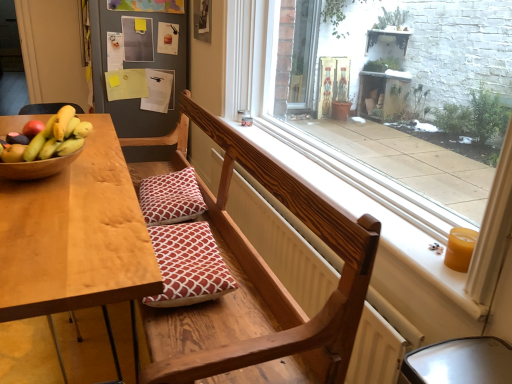
The image size is (512, 384). Identify the location of wooden bench at center. (266, 286).

The width and height of the screenshot is (512, 384). What do you see at coordinates (266, 286) in the screenshot?
I see `wooden bench at center` at bounding box center [266, 286].

At what (x,y) coordinates should I click in order to perform the action: click on red printed cushion at center, which is the 2th pillow in bottom-to-top order. Please return your answer as a coordinate pair (x, y). Looking at the image, I should click on (170, 198).

Measure the distance between point (x=296, y=152) and camera.

Point (x=296, y=152) is 1.93 meters away from camera.

The height and width of the screenshot is (384, 512). What do you see at coordinates (188, 265) in the screenshot? I see `red cotton pillow at center, acting as the 1th pillow starting from the front` at bounding box center [188, 265].

What is the approximate height of yellow wax candle at right?

yellow wax candle at right is 10.22 centimeters in height.

Describe the element at coordinates (284, 243) in the screenshot. I see `wooden radiator at center` at that location.

In the scene shown: What is the approximate height of shiny yellow bananas at table left?

It is 5.24 inches.

Find the location of a particular element. This screenshot has width=512, height=384. wooden table at left is located at coordinates (76, 245).

The image size is (512, 384). What do you see at coordinates (76, 245) in the screenshot?
I see `wooden table at left` at bounding box center [76, 245].

This screenshot has height=384, width=512. In order to click on wooden bench at center in this screenshot , I will do `click(266, 286)`.

Looking at this image, is wooden table at left positioned with its back to red printed cushion at center, which appears as the first pillow when viewed from the top?

Yes, wooden table at left's orientation is away from red printed cushion at center, which appears as the first pillow when viewed from the top.

Does point (5, 291) lie behind point (152, 211)?

No, it is not.

The width and height of the screenshot is (512, 384). What are the coordinates of `kitchen & dining room table that is under the red printed cushion at center, placed as the 2th pillow when sorted from front to back (from a real-world perspective)` in the screenshot? It's located at (76, 245).

Is wooden table at left completely or partially outside of red printed cushion at center, which appears as the first pillow when viewed from the top?

That's correct, wooden table at left is outside of red printed cushion at center, which appears as the first pillow when viewed from the top.

What's the angular difference between transparent glass window at center and yellow wax candle at right's facing directions?

3.6 degrees separate the facing orientations of transparent glass window at center and yellow wax candle at right.

Is yellow wax candle at right inside transparent glass window at center?

That's correct, yellow wax candle at right is inside transparent glass window at center.

Considering the positions of objects transparent glass window at center and yellow wax candle at right in the image provided, who is in front, transparent glass window at center or yellow wax candle at right?

Positioned in front is transparent glass window at center.

Considering the positions of objects transparent glass window at center and yellow wax candle at right in the image provided, who is more to the left, transparent glass window at center or yellow wax candle at right?

transparent glass window at center.

Can you confirm if wooden bowl at left is bigger than wooden bench at center?

No, wooden bowl at left is not bigger than wooden bench at center.

Does wooden bowl at left touch wooden bench at center?

No, wooden bowl at left is not making contact with wooden bench at center.

How far apart are wooden bowl at left and wooden bench at center?

wooden bowl at left is 69.67 centimeters from wooden bench at center.

Is wooden bowl at left oriented towards wooden bench at center?

No, wooden bowl at left is not aimed at wooden bench at center.

What's the angular difference between wooden bowl at left and shiny yellow bananas at table left's facing directions?

90 degrees separate the facing orientations of wooden bowl at left and shiny yellow bananas at table left.

Does wooden bowl at left have a greater width compared to shiny yellow bananas at table left?

Indeed, wooden bowl at left has a greater width compared to shiny yellow bananas at table left.

The height and width of the screenshot is (384, 512). Find the location of `glass bowl below the shiny yellow bananas at table left (from a real-world perspective)`. glass bowl below the shiny yellow bananas at table left (from a real-world perspective) is located at coordinates (37, 167).

From a real-world perspective, is yellow wax candle at right physically above red cotton pillow at center, the first pillow from the bottom?

Correct, in the physical world, yellow wax candle at right is higher than red cotton pillow at center, the first pillow from the bottom.

How different are the orientations of yellow wax candle at right and red cotton pillow at center, marked as the second pillow in a top-to-bottom arrangement, in degrees?

They differ by 0.00114 degrees in their facing directions.

From the image's perspective, which one is positioned higher, yellow wax candle at right or red cotton pillow at center, positioned as the 2th pillow in back-to-front order?

yellow wax candle at right.

Is the surface of yellow wax candle at right in direct contact with red cotton pillow at center, marked as the second pillow in a top-to-bottom arrangement?

No, yellow wax candle at right is not with red cotton pillow at center, marked as the second pillow in a top-to-bottom arrangement.

From a real-world perspective, which object stands above the other?

yellow wax candle at right is physically above.

Is yellow wax candle at right smaller than wooden radiator at center?

Indeed, yellow wax candle at right has a smaller size compared to wooden radiator at center.

Does yellow wax candle at right lie behind wooden radiator at center?

Yes, yellow wax candle at right is further from the viewer.

Is transparent glass window at center positioned with its back to wooden radiator at center?

No, transparent glass window at center is not facing the opposite direction of wooden radiator at center.

Locate an element on the screen. radiator located below the transparent glass window at center (from the image's perspective) is located at coordinates (284, 243).

Considering the sizes of objects transparent glass window at center and wooden radiator at center in the image provided, who is bigger, transparent glass window at center or wooden radiator at center?

Bigger between the two is transparent glass window at center.

Is wooden radiator at center completely or partially inside transparent glass window at center?

Definitely not — wooden radiator at center is not inside transparent glass window at center.

Image resolution: width=512 pixels, height=384 pixels. What are the coordinates of `the 2nd pillow behind the wooden table at left, counting from the anchor's position` in the screenshot? It's located at (170, 198).

The image size is (512, 384). Find the location of `window located on the left of yellow wax candle at right`. window located on the left of yellow wax candle at right is located at coordinates (403, 213).

Based on the photo, based on their spatial positions, is red cotton pillow at center, positioned as the 2th pillow in back-to-front order, or shiny yellow bananas at table left further from yellow wax candle at right?

The object further to yellow wax candle at right is shiny yellow bananas at table left.

From the picture: When comparing their distances from wooden radiator at center, does yellow wax candle at right or shiny yellow bananas at table left seem closer?

yellow wax candle at right.

Estimate the real-world distances between objects in this image. Which object is further from yellow wax candle at right, transparent glass window at center or wooden bench at center?

The object further to yellow wax candle at right is wooden bench at center.

Based on their spatial positions, is wooden bench at center or transparent glass window at center further from wooden table at left?

transparent glass window at center lies further to wooden table at left than the other object.

Based on their spatial positions, is wooden bowl at left or red cotton pillow at center, the first pillow from the bottom, further from yellow wax candle at right?

wooden bowl at left.

From the image, which object appears to be farther from transparent glass window at center, yellow wax candle at right or wooden bench at center?

yellow wax candle at right is positioned further to the anchor transparent glass window at center.

Which object lies nearer to the anchor point red cotton pillow at center, positioned as the 2th pillow in back-to-front order, wooden table at left or wooden radiator at center?

Based on the image, wooden table at left appears to be nearer to red cotton pillow at center, positioned as the 2th pillow in back-to-front order.

Looking at the image, which one is located further to transparent glass window at center, yellow wax candle at right or shiny yellow bananas at table left?

shiny yellow bananas at table left is further to transparent glass window at center.

The image size is (512, 384). Identify the location of bench between red printed cushion at center, which is the 2th pillow in bottom-to-top order, and yellow wax candle at right, in the horizontal direction. (266, 286).

Image resolution: width=512 pixels, height=384 pixels. What are the coordinates of `pillow positioned between wooden bowl at left and red printed cushion at center, which is the 2th pillow in bottom-to-top order, from near to far` in the screenshot? It's located at (188, 265).

Image resolution: width=512 pixels, height=384 pixels. What are the coordinates of `bench situated between shiny yellow bananas at table left and yellow wax candle at right from left to right` in the screenshot? It's located at (266, 286).

I want to click on banana between wooden radiator at center and red printed cushion at center, which appears as the first pillow when viewed from the top, along the z-axis, so click(x=53, y=137).